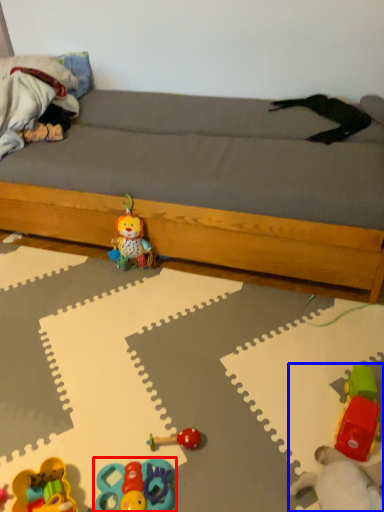
Question: Which point is further to the camera, toy (highlighted by a red box) or toy (highlighted by a blue box)?

Choices:
 (A) toy
 (B) toy

Answer: (A)